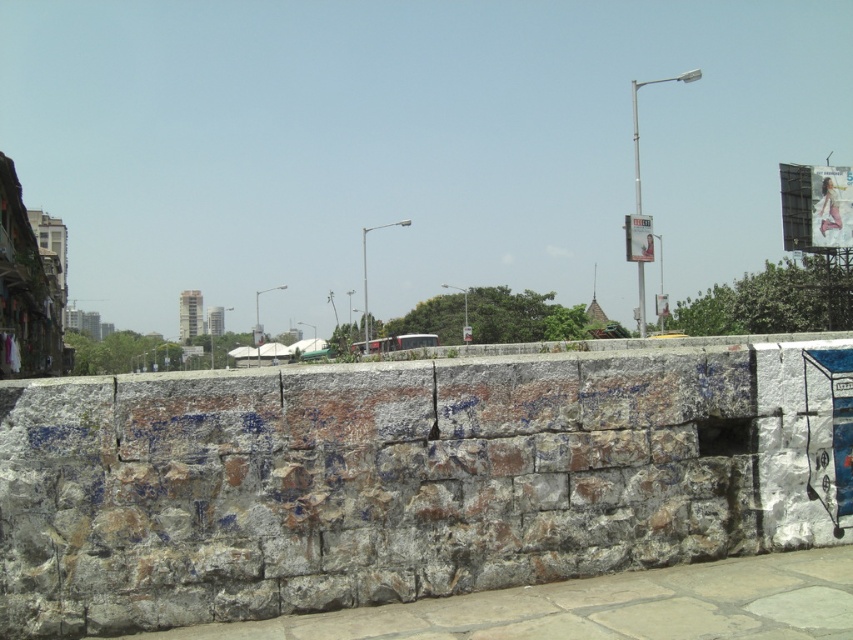
You are a city planner evaluating a public space. You observe the rusty stone wall at center and the gray stone pavement at lower left. Which object occupies a greater area in the scene?

The rusty stone wall at center is larger in size than the gray stone pavement at lower left, so it occupies a greater area in the scene.

You are standing in the urban scene depicted. You see a point marked at coordinates (x=410, y=476). Which object in the scene does this point belong to?

The point at coordinates (x=410, y=476) is on the rusty stone wall at center.

You are standing on the gray stone pavement at lower left and want to walk to the rusty stone wall at center. Which direction should you move to reach it?

The rusty stone wall at center is positioned on the right side of gray stone pavement at lower left, so you should move to your right to reach it.